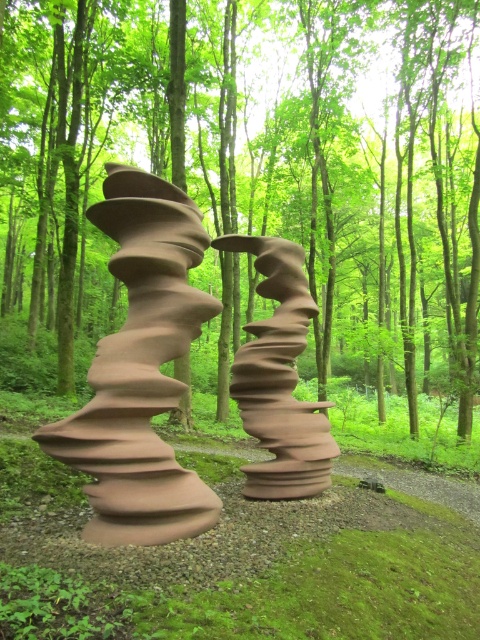
Question: Does brown matte sculpture at center have a larger size compared to matte brown sculpture at center?

Choices:
 (A) no
 (B) yes

Answer: (B)

Question: Is brown matte sculpture at center smaller than matte clay sculpture at center?

Choices:
 (A) yes
 (B) no

Answer: (B)

Question: Among these objects, which one is nearest to the camera?

Choices:
 (A) matte brown sculpture at center
 (B) matte clay sculpture at center

Answer: (A)

Question: Which object appears farthest from the camera in this image?

Choices:
 (A) matte clay sculpture at center
 (B) brown matte sculpture at center

Answer: (B)

Question: Can you confirm if brown matte sculpture at center is wider than matte brown sculpture at center?

Choices:
 (A) yes
 (B) no

Answer: (A)

Question: Among these points, which one is farthest from the camera?

Choices:
 (A) (265, 397)
 (B) (167, 496)
 (C) (273, 134)

Answer: (C)